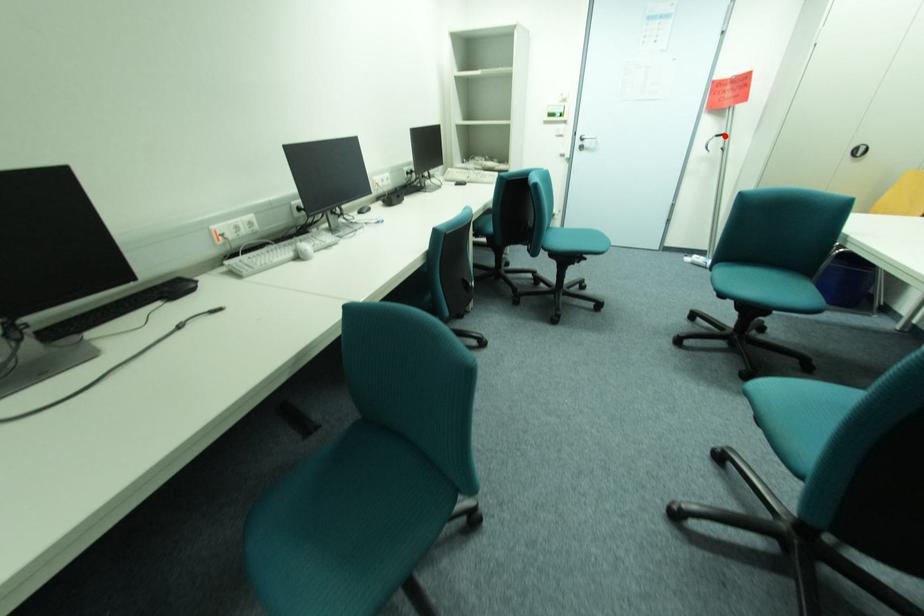
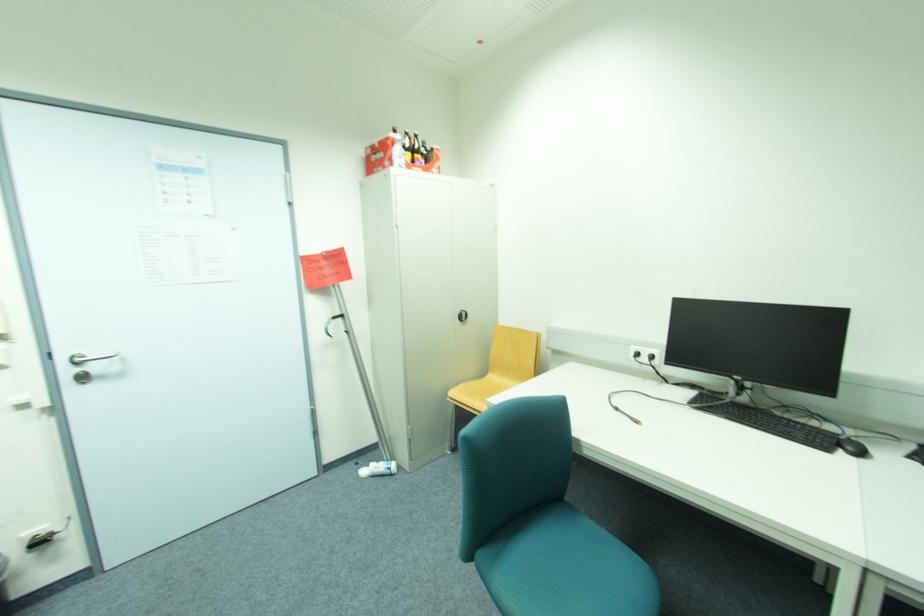
In the second image, find the point that corresponds to the highlighted location in the first image.

(339, 317)